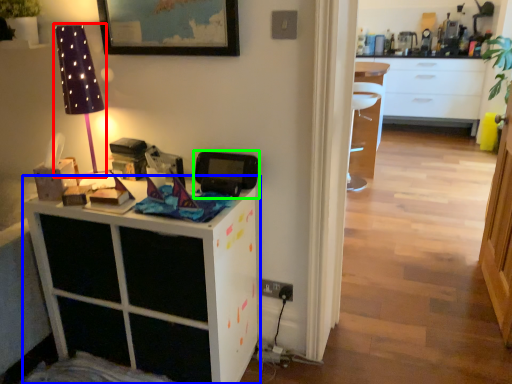
Question: Based on their relative distances, which object is farther from table lamp (highlighted by a red box)? Choose from cabinetry (highlighted by a blue box) and appliance (highlighted by a green box).

Choices:
 (A) cabinetry
 (B) appliance

Answer: (A)